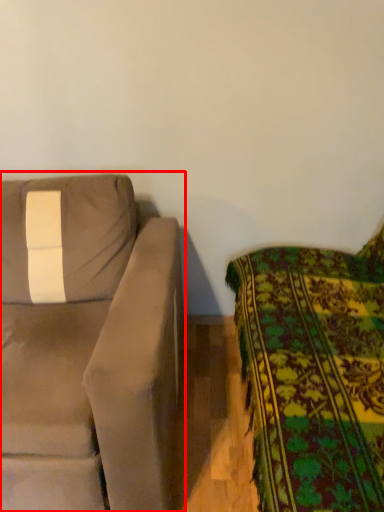
Question: Considering the relative positions of studio couch (annotated by the red box) and studio couch in the image provided, where is studio couch (annotated by the red box) located with respect to the staircase?

Choices:
 (A) right
 (B) left

Answer: (B)